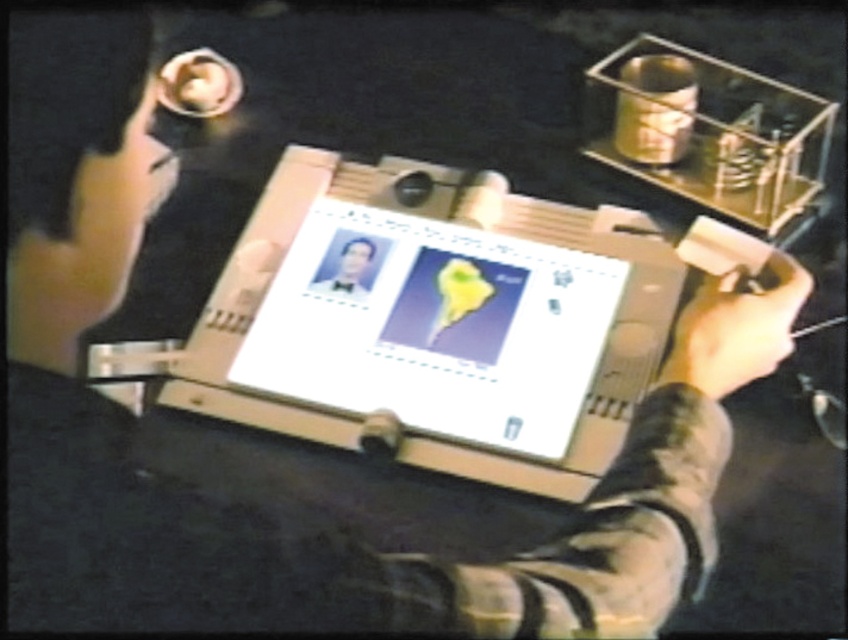
Question: Among these points, which one is nearest to the camera?

Choices:
 (A) (784, 300)
 (B) (250, 352)

Answer: (A)

Question: Which point appears farthest from the camera in this image?

Choices:
 (A) (735, 308)
 (B) (274, 333)

Answer: (B)

Question: Is matte black hand at center further to camera compared to smooth skin portrait at center?

Choices:
 (A) yes
 (B) no

Answer: (B)

Question: Estimate the real-world distances between objects in this image. Which object is closer to the matte black hand at center?

Choices:
 (A) matte plastic computer screen at center
 (B) smooth skin portrait at center

Answer: (A)

Question: Is matte plastic computer screen at center to the right of matte black hand at center from the viewer's perspective?

Choices:
 (A) yes
 (B) no

Answer: (B)

Question: In this image, where is matte black hand at center located relative to smooth skin portrait at center?

Choices:
 (A) left
 (B) right

Answer: (B)